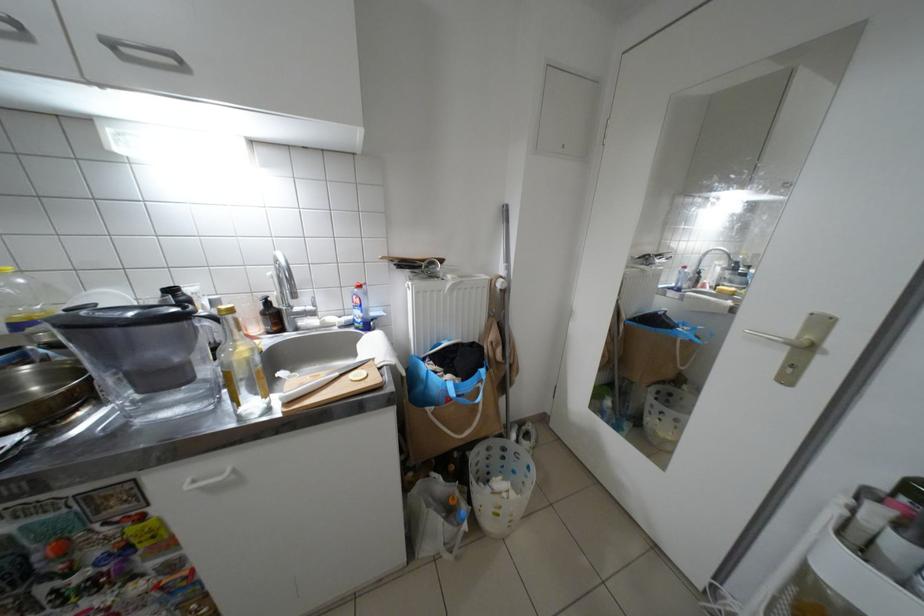
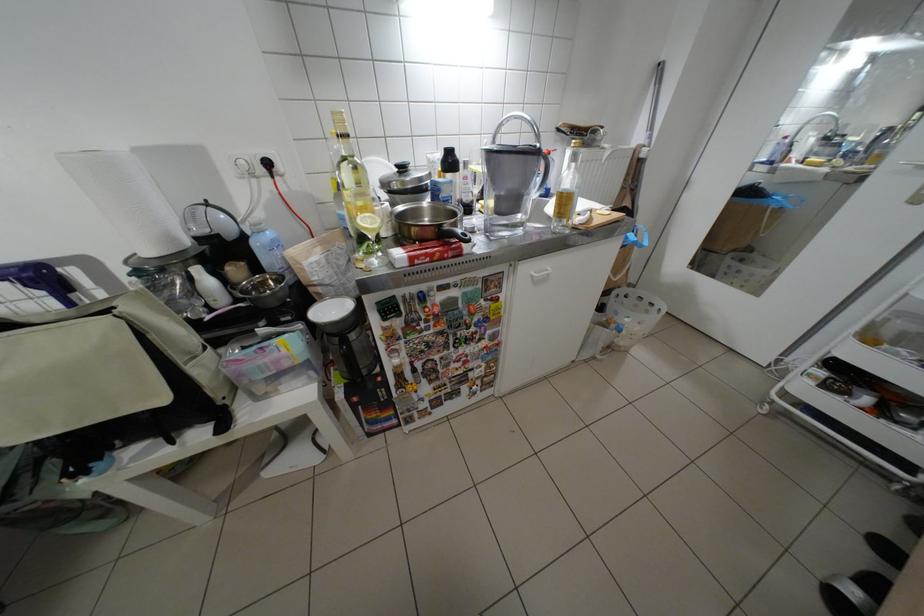
Question: Based on the continuous images, in which direction is the camera rotating? Reply with the corresponding letter.

Choices:
 (A) Left
 (B) Right
 (C) Up
 (D) Down

Answer: (D)